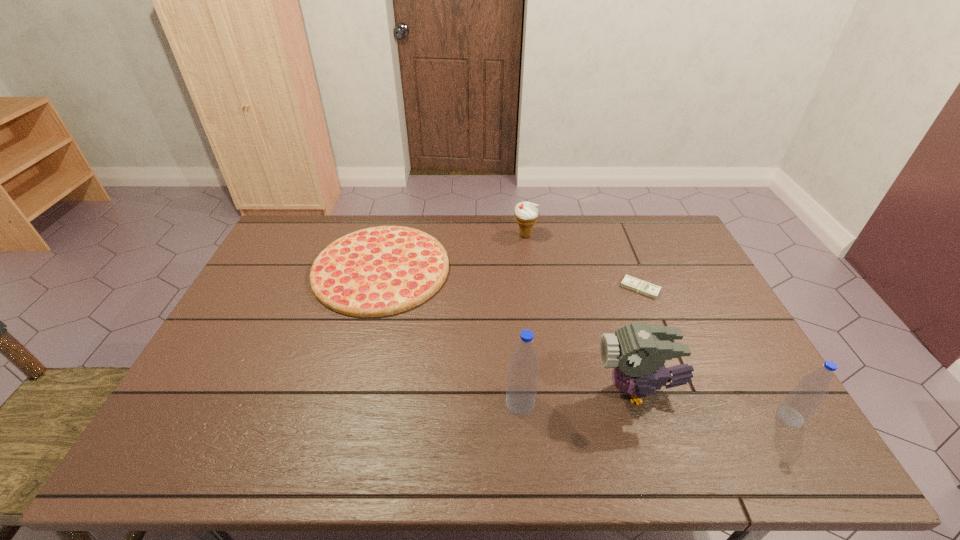
Locate an element on the screen. object that is positioned at the right edge is located at coordinates (804, 399).

Locate an element on the screen. The height and width of the screenshot is (540, 960). object located at the near right corner is located at coordinates (804, 399).

In the image, there is a desktop. Identify the location of vacant space at the far edge. (604, 222).

Image resolution: width=960 pixels, height=540 pixels. Find the location of `vacant area at the near edge`. vacant area at the near edge is located at coordinates (437, 395).

In the image, there is a desktop. At what (x,y) coordinates should I click in order to perform the action: click on free space at the left edge. Please return your answer as a coordinate pair (x, y). Looking at the image, I should click on (229, 338).

I want to click on free spot at the right edge of the desktop, so pos(706,367).

This screenshot has width=960, height=540. Find the location of `vacant space at the near left corner of the desktop`. vacant space at the near left corner of the desktop is located at coordinates (216, 390).

At what (x,y) coordinates should I click in order to perform the action: click on vacant space at the far right corner of the desktop. Please return your answer as a coordinate pair (x, y). The image size is (960, 540). Looking at the image, I should click on (650, 219).

Find the location of a particular element. free space at the near right corner of the desktop is located at coordinates (750, 391).

Locate an element on the screen. Image resolution: width=960 pixels, height=540 pixels. unoccupied position between the shorter water bottle and the second shortest object is located at coordinates (586, 343).